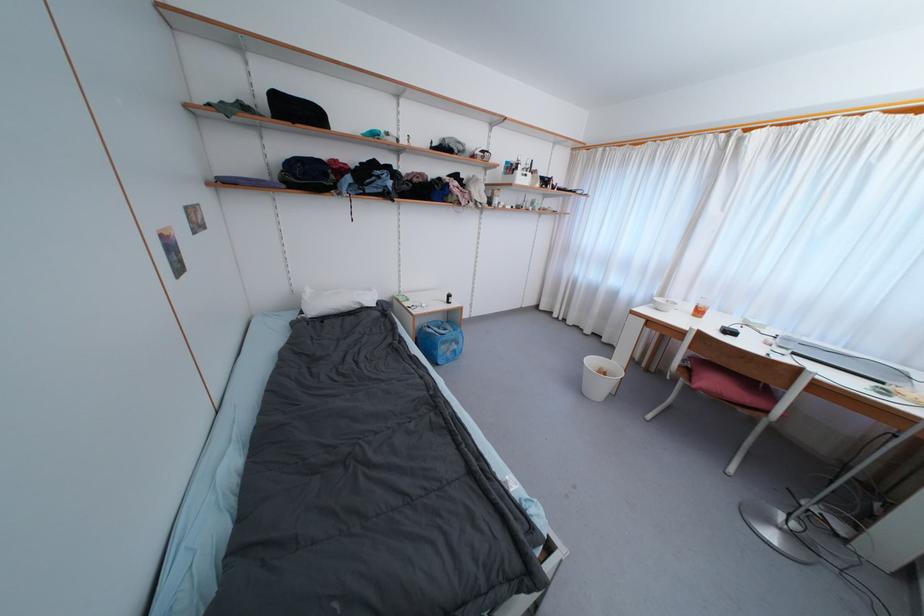
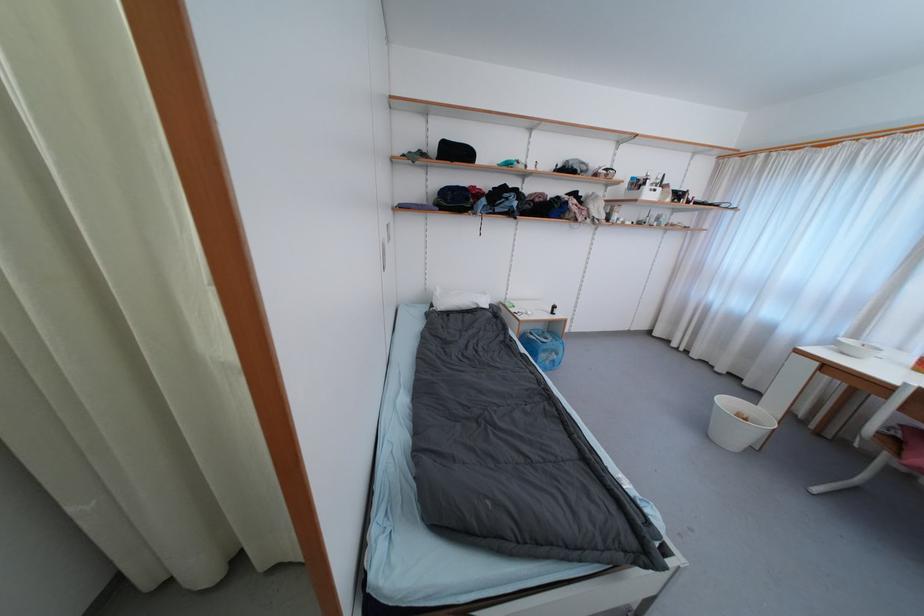
Locate, in the second image, the point that corresponds to [596,363] in the first image.

(732, 405)